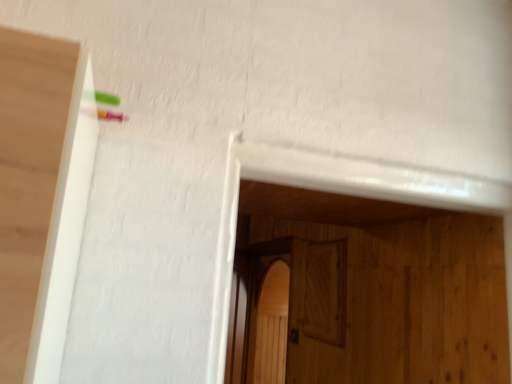
Find the location of a particular element. wooden barn door at center is located at coordinates (289, 304).

Image resolution: width=512 pixels, height=384 pixels. What do you see at coordinates (289, 304) in the screenshot?
I see `wooden barn door at center` at bounding box center [289, 304].

Identify the location of wooden barn door at center. The width and height of the screenshot is (512, 384). (289, 304).